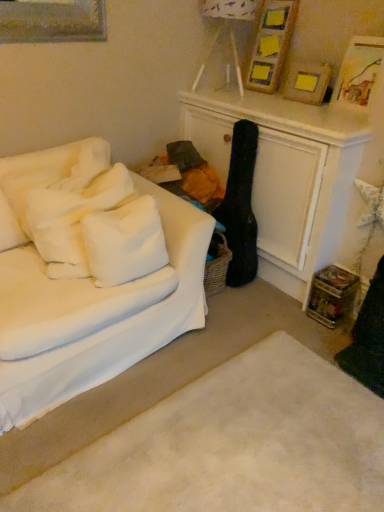
Question: Does wooden picture frame at upper right, which is the second picture frame from right to left, appear on the right side of white soft pillows at left, the 1th pillow when ordered from left to right?

Choices:
 (A) no
 (B) yes

Answer: (B)

Question: Is wooden picture frame at upper right, acting as the 2th picture frame starting from the left, wider than white soft pillows at left, the 1th pillow when ordered from left to right?

Choices:
 (A) yes
 (B) no

Answer: (B)

Question: From a real-world perspective, is wooden picture frame at upper right, which is the second picture frame from right to left, below white soft pillows at left, the 1th pillow when ordered from left to right?

Choices:
 (A) no
 (B) yes

Answer: (A)

Question: Is wooden picture frame at upper right, which is the second picture frame from right to left, not inside white soft pillows at left, the 1th pillow when ordered from left to right?

Choices:
 (A) no
 (B) yes

Answer: (B)

Question: From the image's perspective, is wooden picture frame at upper right, acting as the 2th picture frame starting from the left, located beneath white soft pillows at left, positioned as the second pillow in right-to-left order?

Choices:
 (A) yes
 (B) no

Answer: (B)

Question: Is wooden picture frame at upper right, which is the second picture frame from right to left, not near white soft pillows at left, positioned as the second pillow in right-to-left order?

Choices:
 (A) no
 (B) yes

Answer: (B)

Question: Is white soft rug at lower center thinner than white fluffy pillow at left, the first pillow in the right-to-left sequence?

Choices:
 (A) no
 (B) yes

Answer: (A)

Question: From the image's perspective, is white soft rug at lower center on white fluffy pillow at left, which is the second pillow from left to right?

Choices:
 (A) no
 (B) yes

Answer: (A)

Question: From a real-world perspective, is white soft rug at lower center located beneath white fluffy pillow at left, the first pillow in the right-to-left sequence?

Choices:
 (A) yes
 (B) no

Answer: (A)

Question: Can you confirm if white soft rug at lower center is positioned to the right of white fluffy pillow at left, the first pillow in the right-to-left sequence?

Choices:
 (A) yes
 (B) no

Answer: (A)

Question: Can you confirm if white soft rug at lower center is wider than white fluffy pillow at left, which is the second pillow from left to right?

Choices:
 (A) no
 (B) yes

Answer: (B)

Question: From the image's perspective, would you say white soft rug at lower center is shown under white fluffy pillow at left, which is the second pillow from left to right?

Choices:
 (A) yes
 (B) no

Answer: (A)

Question: Is white fabric couch at left far from white fluffy pillow at left, which is the second pillow from left to right?

Choices:
 (A) no
 (B) yes

Answer: (A)